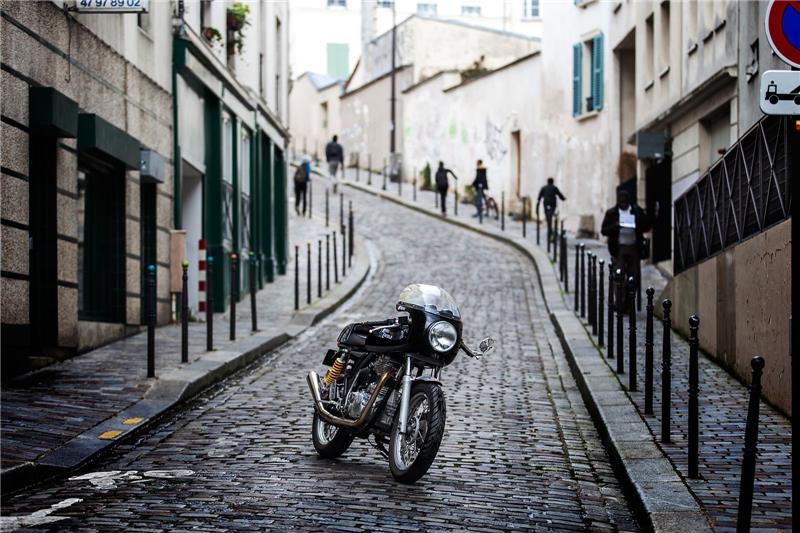
Where is `plant`? plant is located at coordinates (237, 13).